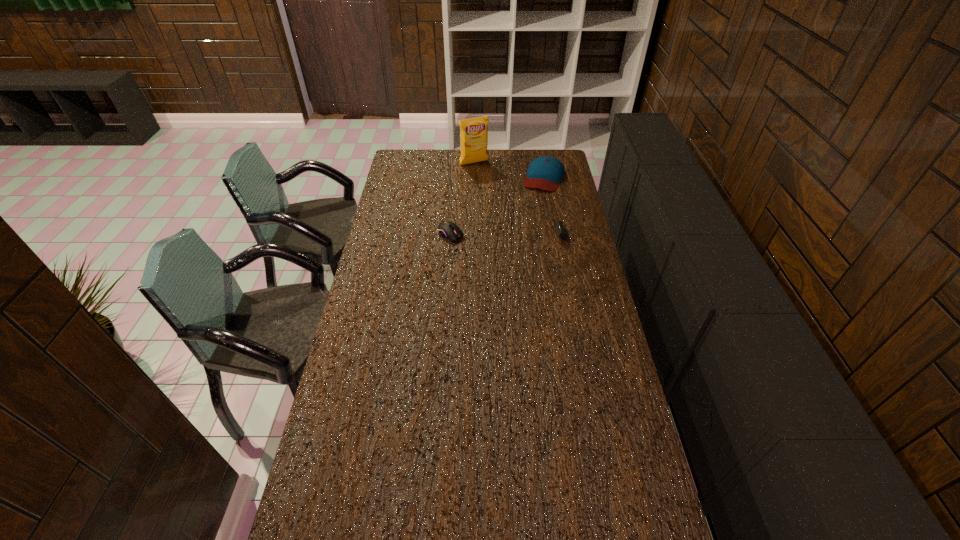
You are a GUI agent. You are given a task and a screenshot of the screen. Output one action in this format:
    pyautogui.click(x=<x>, y=<y>)
    Task: Click on the blank space at the left edge of the desktop
    This screenshot has width=960, height=540.
    Given the screenshot: What is the action you would take?
    pyautogui.click(x=402, y=244)

In the image, there is a desktop. At what (x,y) coordinates should I click in order to perform the action: click on free space at the right edge. Please return your answer as a coordinate pair (x, y). The width and height of the screenshot is (960, 540). Looking at the image, I should click on [x=554, y=192].

Identify the location of vacant space at the far left corner. (408, 152).

This screenshot has width=960, height=540. Identify the location of vacant space at the far right corner of the desktop. (564, 153).

Identify the location of free space that is in between the webcam and the crisp (potato chip). The width and height of the screenshot is (960, 540). tap(529, 198).

This screenshot has width=960, height=540. Identify the location of free area in between the third shortest object and the computer mouse. (497, 206).

Locate an element on the screen. vacant point located between the second tallest object and the webcam is located at coordinates (564, 206).

This screenshot has width=960, height=540. Find the location of `free space between the webcam and the computer mouse`. free space between the webcam and the computer mouse is located at coordinates (517, 234).

Where is `free spot between the webcam and the crisp (potato chip)`? This screenshot has width=960, height=540. free spot between the webcam and the crisp (potato chip) is located at coordinates (529, 198).

The image size is (960, 540). What are the coordinates of `free space between the baseball cap and the webcam` in the screenshot? It's located at (564, 206).